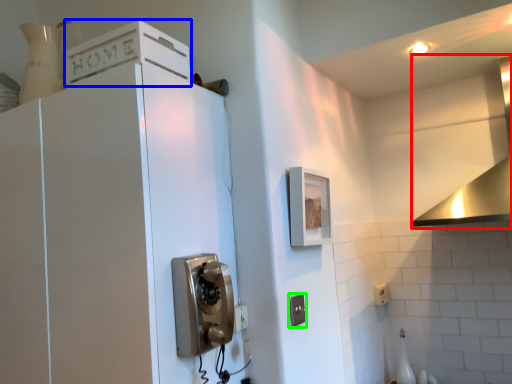
Question: Considering the real-world distances, which object is closest to vent (highlighted by a red box)? cabinetry (highlighted by a blue box) or electric outlet (highlighted by a green box).

Choices:
 (A) cabinetry
 (B) electric outlet

Answer: (B)